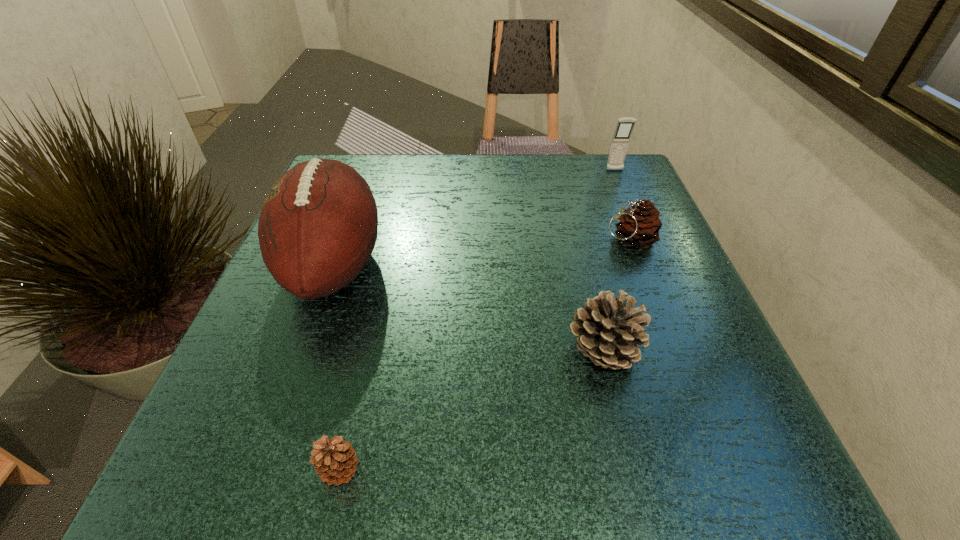
The height and width of the screenshot is (540, 960). Identify the location of vacant space that satisfies the following two spatial constraints: 1. with a leaf charm attached to the farthest pinecone; 2. on the front side of the third shortest object. (672, 351).

Locate an element on the screen. The width and height of the screenshot is (960, 540). free space that satisfies the following two spatial constraints: 1. on the front-facing side of the cellular telephone; 2. with a leaf charm attached to the second shortest object is located at coordinates (643, 239).

The width and height of the screenshot is (960, 540). In order to click on vacant space that satisfies the following two spatial constraints: 1. on the back side of the leftmost pinecone; 2. on the right side of the second nearest pinecone in this screenshot , I will do `click(367, 351)`.